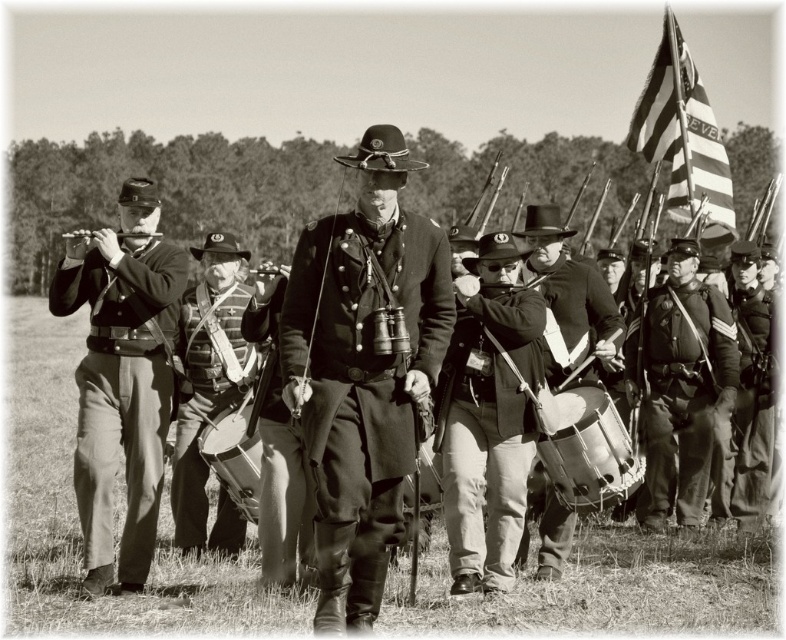
You are a photographer planning to take a group photo of the matte black uniform at left and the matte leather drum at center. Based on their heights, which object should be placed closer to the front to ensure both are fully visible in the photo?

The matte leather drum at center should be placed closer to the front because it is shorter than the matte black uniform at left, allowing both to be fully visible in the photo.

Based on the scene description, where is the matte black uniform at center located in the image?

The matte black uniform at center is located at point coordinates of 0.828 on the x axis and 0.101 on the y axis.